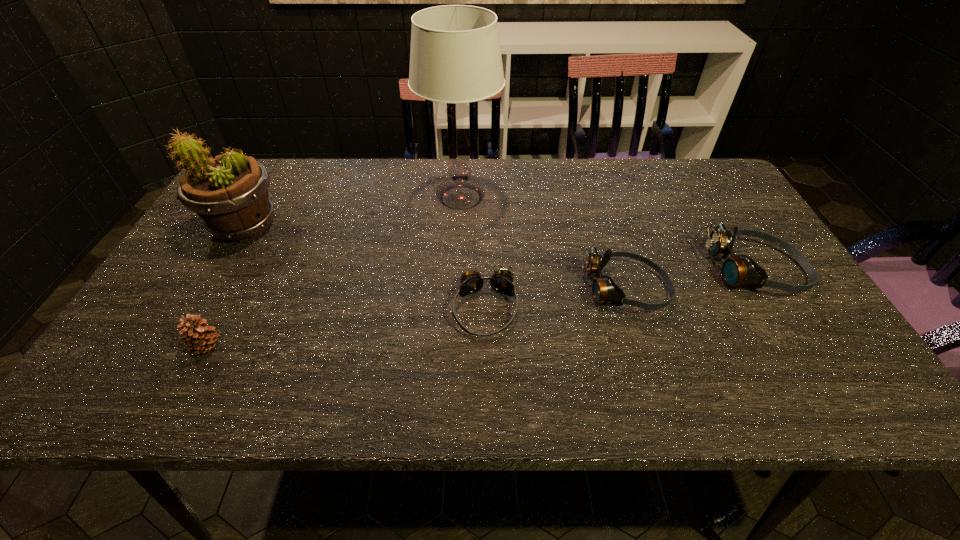
Locate an element on the screen. free space between the second shortest goggles and the rightmost goggles is located at coordinates (691, 280).

What are the coordinates of `free point between the table lamp and the shortest object` in the screenshot? It's located at (473, 253).

Locate an element on the screen. The image size is (960, 540). empty location between the fifth object from left to right and the second tallest object is located at coordinates (435, 258).

You are a GUI agent. You are given a task and a screenshot of the screen. Output one action in this format:
    pyautogui.click(x=<x>, y=<y>)
    Task: Click on the free spot between the second goggles from left to right and the shortest goggles
    This screenshot has width=960, height=540.
    Given the screenshot: What is the action you would take?
    pyautogui.click(x=555, y=299)

Identify the location of free space between the leftmost goggles and the flowerpot. The image size is (960, 540). (365, 267).

Locate an element on the screen. The height and width of the screenshot is (540, 960). free space between the fifth object from left to right and the flowerpot is located at coordinates (435, 258).

I want to click on free space between the second goggles from right to left and the pinecone, so click(417, 318).

Choose which object is the fourth nearest neighbor to the second goggles from left to right. Please provide its 2D coordinates. Your answer should be formatted as a tuple, i.e. [(x, y)], where the tuple contains the x and y coordinates of a point satisfying the conditions above.

[(229, 193)]

Identify which object is located as the third nearest to the fifth tallest object. Please provide its 2D coordinates. Your answer should be formatted as a tuple, i.e. [(x, y)], where the tuple contains the x and y coordinates of a point satisfying the conditions above.

[(455, 57)]

This screenshot has height=540, width=960. In order to click on goggles that is the second nearest to the shortest object in this screenshot , I will do `click(740, 270)`.